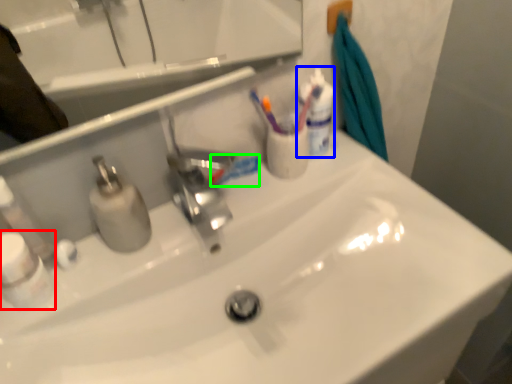
Question: Which object is the farthest from mouthwash (highlighted by a red box)? Choose among these: mouthwash (highlighted by a blue box) or toothpaste (highlighted by a green box).

Choices:
 (A) mouthwash
 (B) toothpaste

Answer: (A)